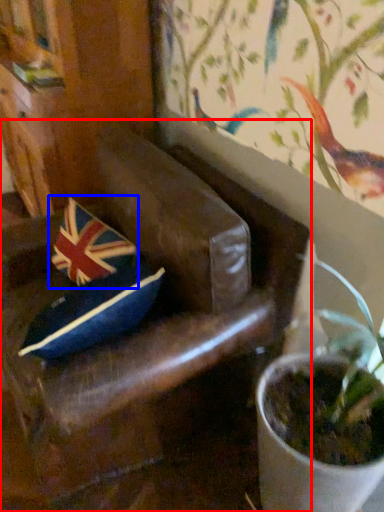
Question: Which point is closer to the camera, chair (highlighted by a red box) or flag (highlighted by a blue box)?

Choices:
 (A) chair
 (B) flag

Answer: (A)